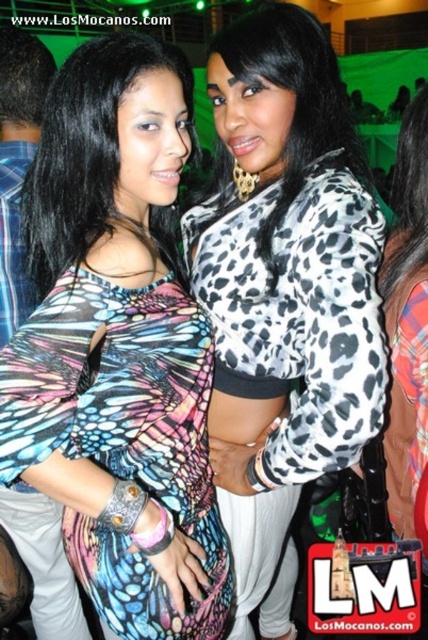
You are at a party and see two women standing together. The woman wearing the multicolored printed dress at center and the woman wearing the leopard print jacket at center. Which woman is standing to the left?

The woman wearing the multicolored printed dress at center is standing to the left of the woman wearing the leopard print jacket at center.

You are at a social event and want to take a photo of the multicolored printed dress at center. Where should you position yourself to capture it in the frame?

The multicolored printed dress at center is located at point (118, 348), so position yourself directly in front of that coordinate to capture it in the frame.